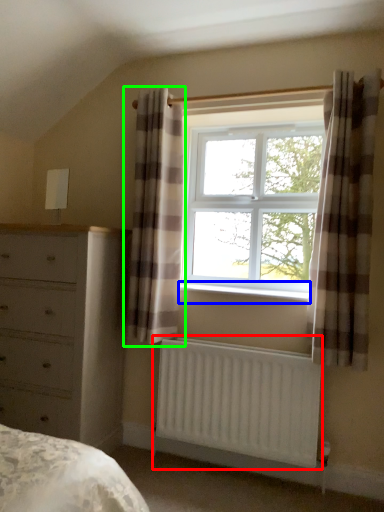
Question: Considering the real-world distances, which object is closest to radiator (highlighted by a red box)? window sill (highlighted by a blue box) or curtain (highlighted by a green box).

Choices:
 (A) window sill
 (B) curtain

Answer: (A)